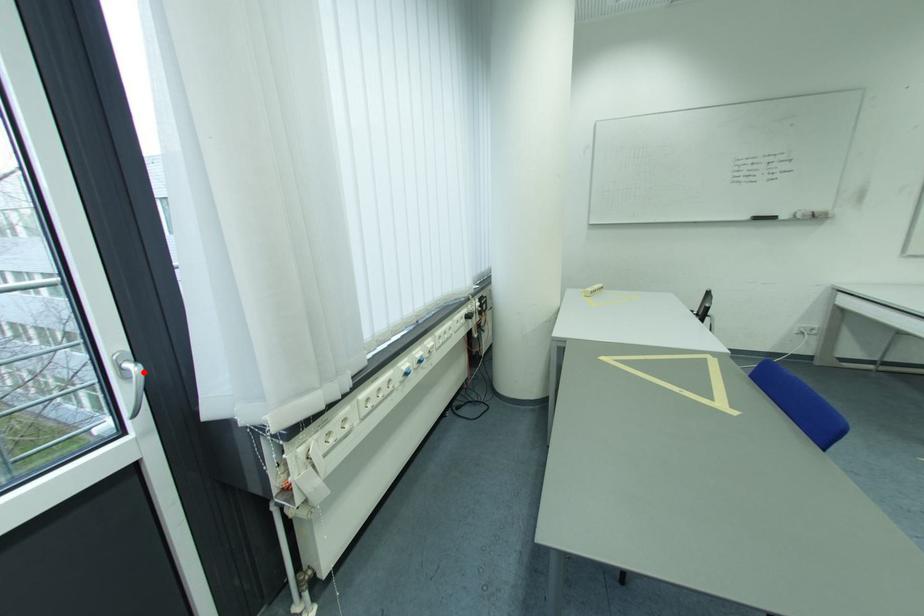
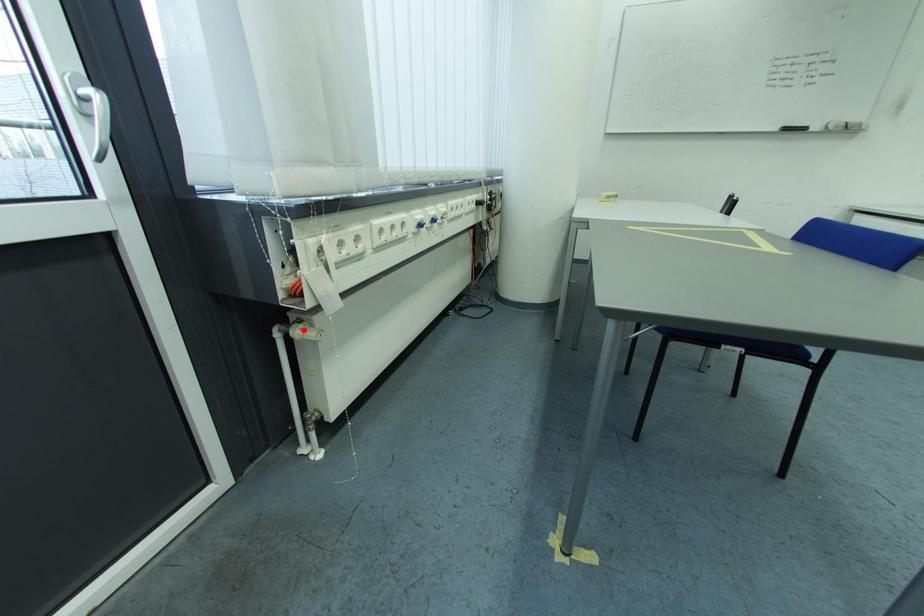
I am providing you with two images of the same scene from different viewpoints. A red point is marked on the first image and another point is marked on the second image. Is the marked point in image1 the same physical position as the marked point in image2?

No